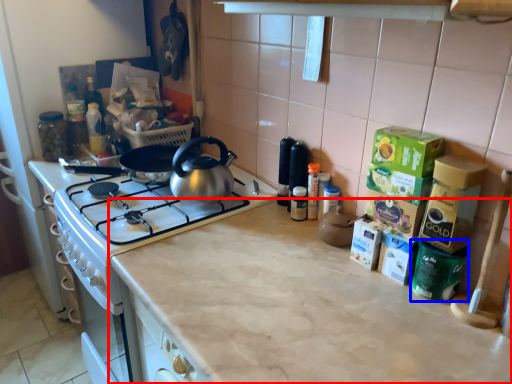
Question: Which object appears closest to the camera in this image, countertop (highlighted by a red box) or appliance (highlighted by a blue box)?

Choices:
 (A) countertop
 (B) appliance

Answer: (A)